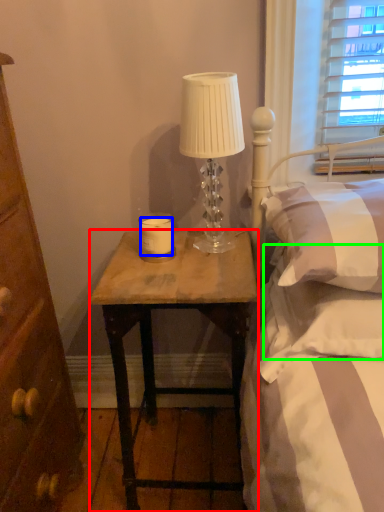
Question: Which is nearer to the desk (highlighted by a red box)? candle (highlighted by a blue box) or pillow (highlighted by a green box).

Choices:
 (A) candle
 (B) pillow

Answer: (B)